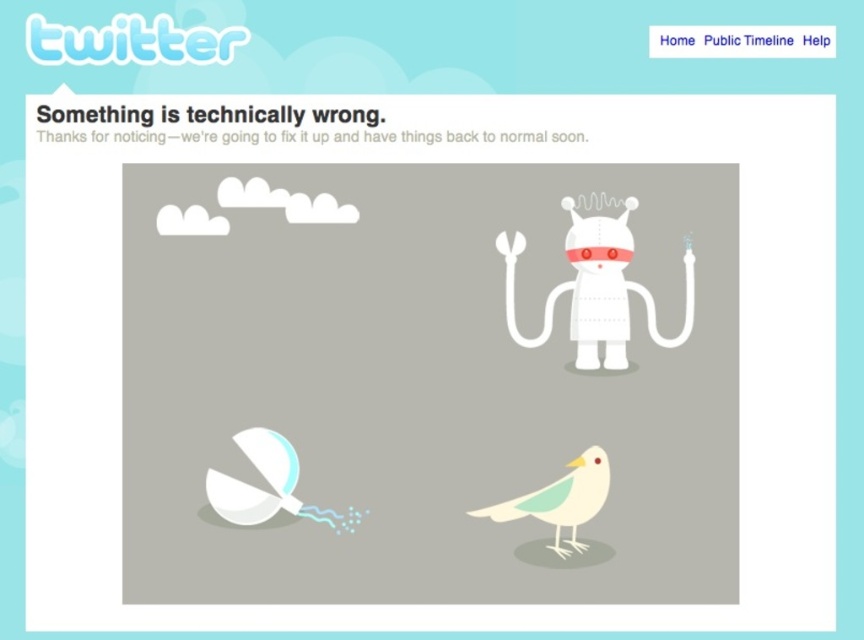
You are a delivery person trying to deliver a package to the white matte robot at center. The robot is 26.89 inches away from you. Can you reach the robot with your 30 inch long tool?

The white matte robot at center is 26.89 inches away from the camera, so yes, the 30 inch long tool can reach it since it is longer than the distance.

You are a delivery person trying to place a small package between the white matte robot at center and the white matte bird at center. Can you fit the package between them if the package is 1 meter wide?

The white matte robot at center is wider than the white matte bird at center. Since the package is 1 meter wide, it depends on the actual widths of the robot and bird. However, the description only states the robot is wider, not by how much. Without specific measurements, we cannot confirm if the space between them is sufficient for the package.